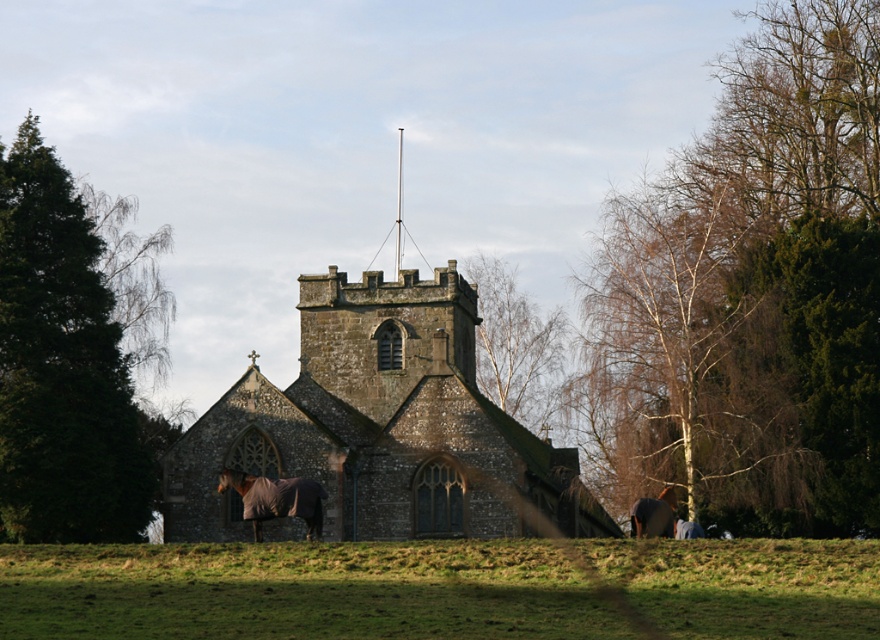
You are a photographer planning to take a landscape photo that includes both the stone church at center and the brown fleece horse at lower left. Given that the church must be the main focus, which object should you position closer to the camera to ensure it stands out more in the composition?

A: To make the stone church at center the main focus, position it closer to the camera since it is larger in size than the brown fleece horse at lower left, which will help it stand out more in the composition.

You are standing in the countryside and see the stone church at center and the brown fleece horse at lower left. Which object is positioned more to the east if the church is facing north?

The brown fleece horse at lower left is positioned more to the east because the stone church at center is facing north, meaning its entrance faces north. Since the stone church at center is to the right of the brown fleece horse at lower left, the horse must be to the east side of the church.